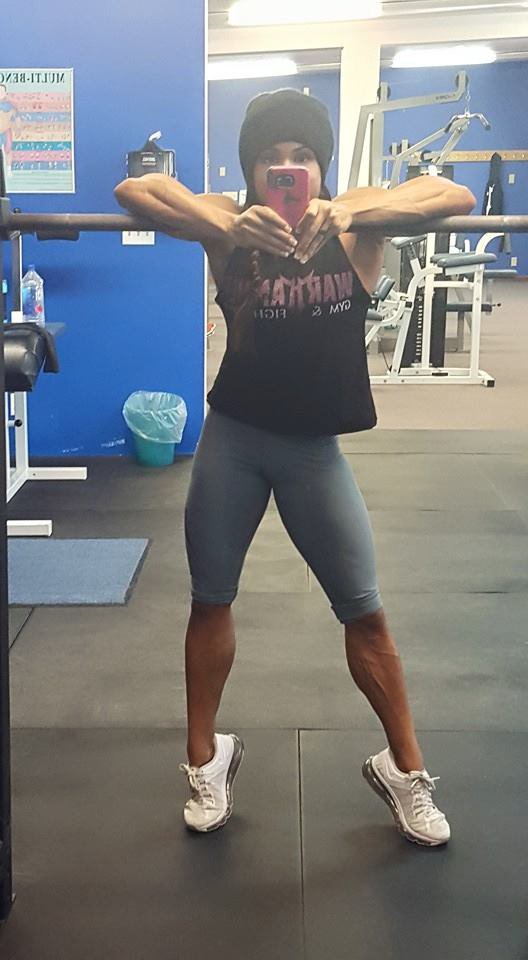
The height and width of the screenshot is (960, 528). Find the location of `bar`. bar is located at coordinates tap(78, 220).